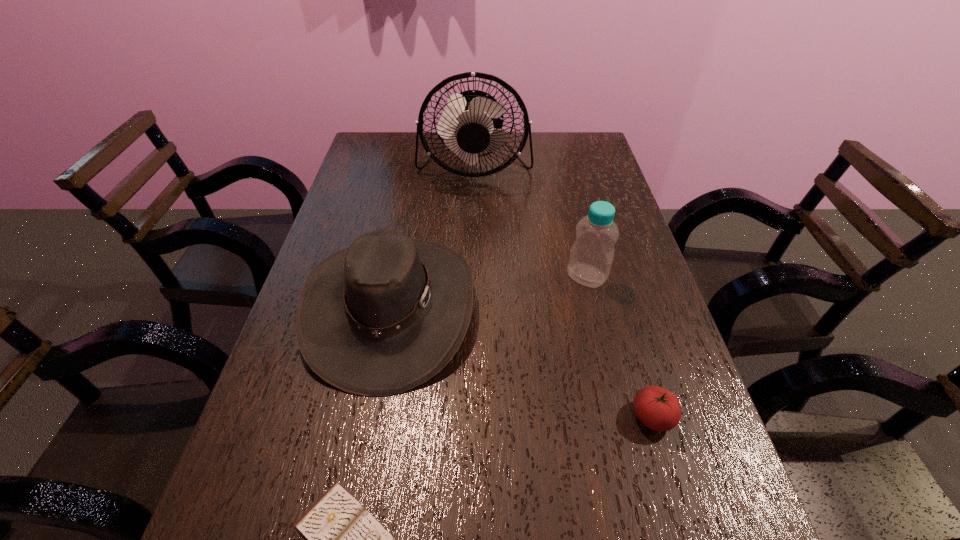
The width and height of the screenshot is (960, 540). What are the coordinates of `blank region between the farthest object and the fourth tallest object` in the screenshot? It's located at (564, 292).

Where is `free space between the fourth tallest object and the fan`? Image resolution: width=960 pixels, height=540 pixels. free space between the fourth tallest object and the fan is located at coordinates (564, 292).

Image resolution: width=960 pixels, height=540 pixels. Identify the location of empty space that is in between the fourth tallest object and the cowboy hat. (521, 362).

Where is `free spot between the bottle and the third shortest object`? This screenshot has width=960, height=540. free spot between the bottle and the third shortest object is located at coordinates (489, 292).

Where is `unoccupied area between the fourth tallest object and the third shortest object`? unoccupied area between the fourth tallest object and the third shortest object is located at coordinates (521, 362).

Where is `empty space between the bottle and the third tallest object`? The image size is (960, 540). empty space between the bottle and the third tallest object is located at coordinates (489, 292).

Locate an element on the screen. The image size is (960, 540). object that is the closest one to the diary is located at coordinates (379, 318).

Point out which object is positioned as the nearest to the bottle. Please provide its 2D coordinates. Your answer should be formatted as a tuple, i.e. [(x, y)], where the tuple contains the x and y coordinates of a point satisfying the conditions above.

[(379, 318)]

At what (x,y) coordinates should I click in order to perform the action: click on free space that satisfies the following two spatial constraints: 1. on the front-facing side of the fourth farthest object; 2. on the left side of the third tallest object. Please return your answer as a coordinate pair (x, y). Looking at the image, I should click on (371, 417).

Find the location of a particular element. vacant area in the image that satisfies the following two spatial constraints: 1. on the front-facing side of the second shortest object; 2. on the left side of the cowboy hat is located at coordinates (371, 417).